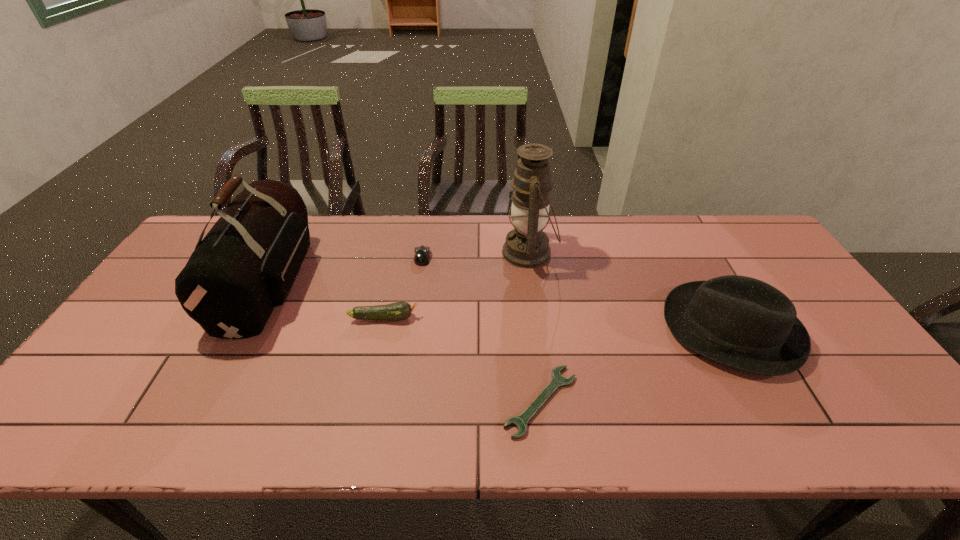
Find the location of a particular element. oil lamp is located at coordinates (527, 246).

The height and width of the screenshot is (540, 960). I want to click on the leftmost object, so click(245, 266).

At what (x,y) coordinates should I click in order to perform the action: click on fedora. Please return your answer as a coordinate pair (x, y). The width and height of the screenshot is (960, 540). Looking at the image, I should click on coord(740,322).

Find the location of `the third tallest object`. the third tallest object is located at coordinates (740, 322).

The width and height of the screenshot is (960, 540). In order to click on the third shortest object in this screenshot , I will do `click(397, 311)`.

Image resolution: width=960 pixels, height=540 pixels. Find the location of `the second shortest object`. the second shortest object is located at coordinates (422, 254).

The width and height of the screenshot is (960, 540). Identify the location of wrench. (520, 422).

Identify the location of blank area located 0.080m on the back of the oil lamp. tap(524, 218).

Identify the location of vacant area situated 0.120m on the front pocket of the duffel bag. Image resolution: width=960 pixels, height=540 pixels. (348, 282).

The width and height of the screenshot is (960, 540). In order to click on vacant area situated on the left of the third tallest object in this screenshot , I will do `click(619, 329)`.